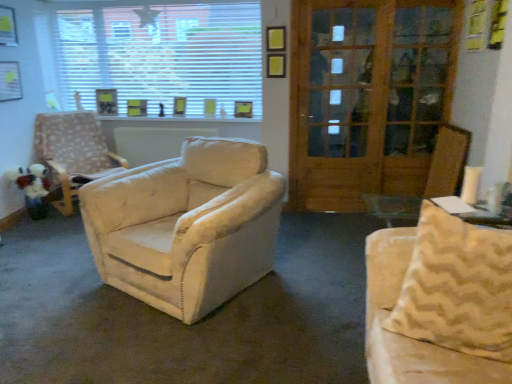
What do you see at coordinates (337, 101) in the screenshot? I see `wooden screen door at right` at bounding box center [337, 101].

Locate an element on the screen. The height and width of the screenshot is (384, 512). white plush toy at left is located at coordinates (33, 188).

The height and width of the screenshot is (384, 512). I want to click on wooden door at center, so click(367, 97).

Locate an element on the screen. This screenshot has width=512, height=384. beige fabric armchair at left is located at coordinates (73, 151).

From a real-world perspective, is white plush toy at left beneath white blinds at upper center?

Yes, from a real-world perspective, white plush toy at left is beneath white blinds at upper center.

In terms of height, does white plush toy at left look taller or shorter compared to white blinds at upper center?

Considering their sizes, white plush toy at left has less height than white blinds at upper center.

Locate an element on the screen. The height and width of the screenshot is (384, 512). window above the white plush toy at left (from a real-world perspective) is located at coordinates (163, 55).

Is white plush toy at left touching white blinds at upper center?

No, white plush toy at left is not touching white blinds at upper center.

Locate an element on the screen. The image size is (512, 384). door behind the beige fabric couch at right is located at coordinates (367, 97).

Is wooden door at center at the back of beige fabric couch at right?

Yes.

From the image's perspective, which is below, beige fabric couch at right or wooden door at center?

beige fabric couch at right.

Is beige fabric couch at right positioned behind beige fabric armchair at left?

No, beige fabric couch at right is in front of beige fabric armchair at left.

From the image's perspective, between beige fabric couch at right and beige fabric armchair at left, who is located below?

beige fabric couch at right appears lower in the image.

Is beige fabric couch at right directly adjacent to beige fabric armchair at left?

There is a gap between beige fabric couch at right and beige fabric armchair at left.

Between white blinds at upper center and beige fabric armchair at left, which one has less height?

Standing shorter between the two is beige fabric armchair at left.

Is beige fabric armchair at left completely or partially inside white blinds at upper center?

No, beige fabric armchair at left is not surrounded by white blinds at upper center.

Is white blinds at upper center facing away from beige fabric armchair at left?

No.

This screenshot has width=512, height=384. I want to click on window above the beige fabric armchair at left (from a real-world perspective), so click(x=163, y=55).

Is white blinds at upper center far from wooden screen door at right?

That's right, there is a large distance between white blinds at upper center and wooden screen door at right.

Does white blinds at upper center turn towards wooden screen door at right?

No.

Would you say wooden screen door at right is part of white blinds at upper center's contents?

No, wooden screen door at right is located outside of white blinds at upper center.

Considering the points (227, 39) and (302, 122), which point is in front, point (227, 39) or point (302, 122)?

The point (302, 122) is in front.

Which is more to the right, wooden screen door at right or white plush toy at left?

wooden screen door at right.

Which of these two, wooden screen door at right or white plush toy at left, is wider?

white plush toy at left is wider.

Is wooden screen door at right bigger than white plush toy at left?

Correct, wooden screen door at right is larger in size than white plush toy at left.

Is white plush toy at left directly adjacent to beige fabric couch at right?

white plush toy at left and beige fabric couch at right are clearly separated.

Could you tell me if white plush toy at left is turned towards beige fabric couch at right?

No.

From the image's perspective, is white plush toy at left positioned above or below beige fabric couch at right?

white plush toy at left is situated higher than beige fabric couch at right in the image.

Where is `window that appears behind the white plush toy at left`? This screenshot has width=512, height=384. window that appears behind the white plush toy at left is located at coordinates (163, 55).

Find the location of `door on the right side of beige fabric couch at right`. door on the right side of beige fabric couch at right is located at coordinates (367, 97).

Based on their spatial positions, is white blinds at upper center or beige fabric armchair at left closer to wooden door at center?

The object closer to wooden door at center is white blinds at upper center.

Which object lies nearer to the anchor point beige fabric couch at right, white plush toy at left or beige fabric armchair at left?

beige fabric armchair at left is positioned closer to the anchor beige fabric couch at right.

Considering their positions, is beige fabric couch at right positioned further to wooden door at center than white blinds at upper center?

The object further to wooden door at center is beige fabric couch at right.

From the image, which object appears to be farther from wooden door at center, white plush toy at left or wooden screen door at right?

Based on the image, white plush toy at left appears to be further to wooden door at center.

Looking at the image, which one is located closer to wooden door at center, beige fabric couch at right or wooden screen door at right?

wooden screen door at right lies closer to wooden door at center than the other object.

From the image, which object appears to be farther from wooden screen door at right, beige fabric armchair at left or wooden door at center?

beige fabric armchair at left lies further to wooden screen door at right than the other object.

Which object lies nearer to the anchor point wooden door at center, wooden screen door at right or white blinds at upper center?

wooden screen door at right is closer to wooden door at center.

Based on their spatial positions, is wooden door at center or white blinds at upper center further from beige fabric couch at right?

white blinds at upper center.

Where is `chair situated between white plush toy at left and wooden door at center from left to right`? The image size is (512, 384). chair situated between white plush toy at left and wooden door at center from left to right is located at coordinates (73, 151).

What are the coordinates of `screen door between beige fabric couch at right and white blinds at upper center from front to back` in the screenshot? It's located at point(337,101).

Locate an element on the screen. The image size is (512, 384). door located between beige fabric couch at right and wooden screen door at right in the depth direction is located at coordinates (367, 97).

The height and width of the screenshot is (384, 512). I want to click on studio couch situated between white plush toy at left and wooden door at center from left to right, so [x=439, y=302].